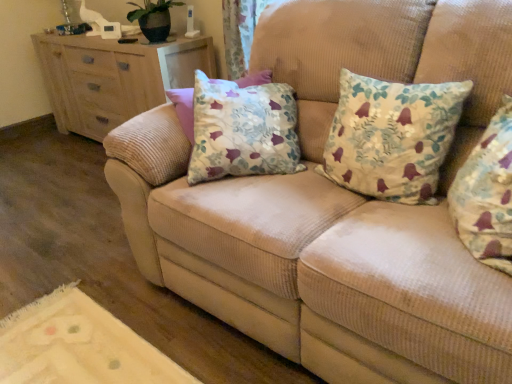
Question: Can you confirm if floral fabric pillow at center, arranged as the first pillow when viewed from the back, is positioned to the right of floral fabric cushion at center, placed as the second pillow when sorted from back to front?

Choices:
 (A) no
 (B) yes

Answer: (A)

Question: Considering the relative sizes of floral fabric pillow at center, the second pillow positioned from the front, and floral fabric cushion at center, placed as the second pillow when sorted from back to front, in the image provided, is floral fabric pillow at center, the second pillow positioned from the front, bigger than floral fabric cushion at center, placed as the second pillow when sorted from back to front,?

Choices:
 (A) yes
 (B) no

Answer: (A)

Question: From the image's perspective, would you say floral fabric pillow at center, arranged as the first pillow when viewed from the back, is shown under floral fabric cushion at center, placed as the second pillow when sorted from back to front?

Choices:
 (A) no
 (B) yes

Answer: (A)

Question: From the image's perspective, does floral fabric pillow at center, arranged as the first pillow when viewed from the back, appear higher than floral fabric cushion at center, placed as the second pillow when sorted from back to front?

Choices:
 (A) no
 (B) yes

Answer: (B)

Question: From a real-world perspective, is floral fabric pillow at center, arranged as the first pillow when viewed from the back, under floral fabric cushion at center, placed as the second pillow when sorted from back to front?

Choices:
 (A) no
 (B) yes

Answer: (B)

Question: Choose the correct answer: Is floral fabric cushion at center, placed as the second pillow when sorted from back to front, inside wooden chest of drawers at left or outside it?

Choices:
 (A) inside
 (B) outside

Answer: (B)

Question: From a real-world perspective, is floral fabric cushion at center, placed as the second pillow when sorted from back to front, positioned above or below wooden chest of drawers at left?

Choices:
 (A) above
 (B) below

Answer: (A)

Question: Would you say floral fabric cushion at center, which is the 1th pillow from front to back, is to the left or to the right of wooden chest of drawers at left in the picture?

Choices:
 (A) left
 (B) right

Answer: (B)

Question: Relative to wooden chest of drawers at left, is floral fabric cushion at center, placed as the second pillow when sorted from back to front, in front or behind?

Choices:
 (A) behind
 (B) front

Answer: (B)

Question: Considering the positions of wooden chest of drawers at left and floral fabric pillow at center, the second pillow positioned from the front, in the image, is wooden chest of drawers at left bigger or smaller than floral fabric pillow at center, the second pillow positioned from the front,?

Choices:
 (A) big
 (B) small

Answer: (A)

Question: Is wooden chest of drawers at left in front of or behind floral fabric pillow at center, the second pillow positioned from the front, in the image?

Choices:
 (A) front
 (B) behind

Answer: (B)

Question: From the image's perspective, is wooden chest of drawers at left located above or below floral fabric pillow at center, the second pillow positioned from the front?

Choices:
 (A) below
 (B) above

Answer: (B)

Question: Considering the positions of wooden chest of drawers at left and floral fabric pillow at center, the second pillow positioned from the front, in the image, is wooden chest of drawers at left wider or thinner than floral fabric pillow at center, the second pillow positioned from the front,?

Choices:
 (A) wide
 (B) thin

Answer: (A)

Question: Which is correct: floral fabric pillow at center, the second pillow positioned from the front, is inside floral fabric cushion at center, placed as the second pillow when sorted from back to front, or outside of it?

Choices:
 (A) outside
 (B) inside

Answer: (A)

Question: Is point (413, 99) closer or farther from the camera than point (490, 231)?

Choices:
 (A) closer
 (B) farther

Answer: (B)